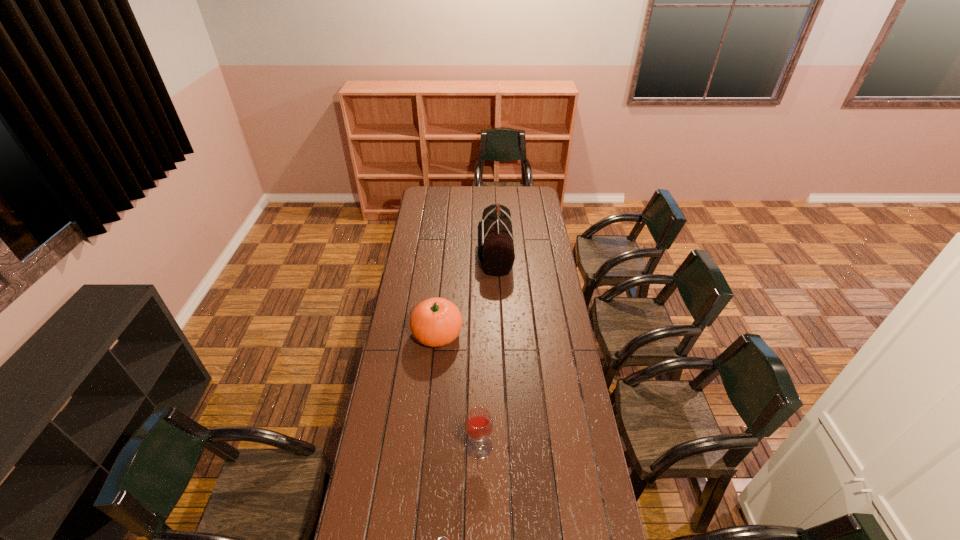
Where is `the tallest object`? the tallest object is located at coordinates (495, 249).

At what (x,y) coordinates should I click in order to perform the action: click on duffel bag. Please return your answer as a coordinate pair (x, y). This screenshot has height=540, width=960. Looking at the image, I should click on (495, 249).

Identify the location of pumpkin. (435, 322).

Locate an element on the screen. This screenshot has height=540, width=960. wineglass is located at coordinates (478, 423).

Locate an element on the screen. free location located 0.250m on the front pocket of the farthest object is located at coordinates (432, 253).

Find the location of a particular element. The width and height of the screenshot is (960, 540). blank space located on the front pocket of the farthest object is located at coordinates (438, 253).

Where is `vacant space situated 0.390m on the front pocket of the farthest object`? vacant space situated 0.390m on the front pocket of the farthest object is located at coordinates (407, 253).

The width and height of the screenshot is (960, 540). What are the coordinates of `vacant space positioned on the back of the second farthest object` in the screenshot? It's located at (443, 282).

The image size is (960, 540). Identify the location of free region located on the front of the wineglass. (479, 507).

This screenshot has width=960, height=540. Find the location of `object that is at the left edge`. object that is at the left edge is located at coordinates (435, 322).